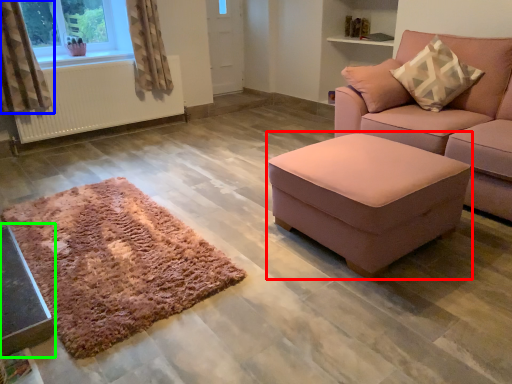
Question: Estimate the real-world distances between objects in this image. Which object is farther from table (highlighted by a red box), curtain (highlighted by a blue box) or table (highlighted by a green box)?

Choices:
 (A) curtain
 (B) table

Answer: (A)